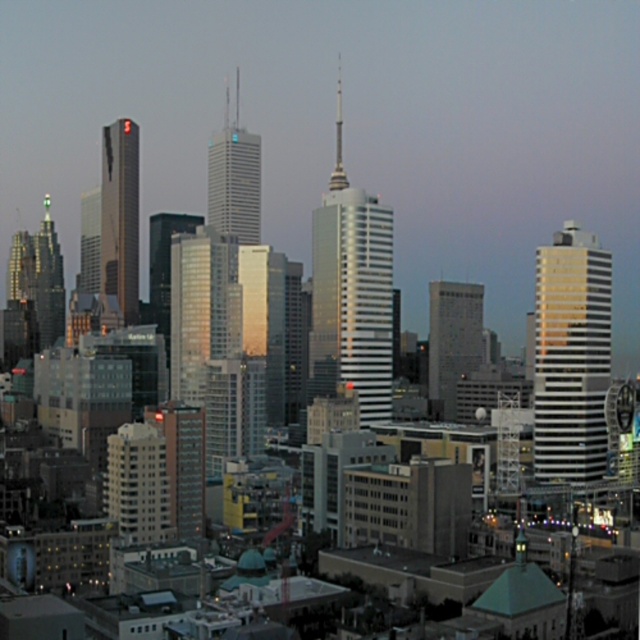
You are an urban planner analyzing the cityscape. You notice two skyscrapers labeled as shiny silver skyscraper at center and silver glass skyscraper at center. Which one is positioned lower in the image?

The shiny silver skyscraper at center is positioned lower than the silver glass skyscraper at center according to the description.